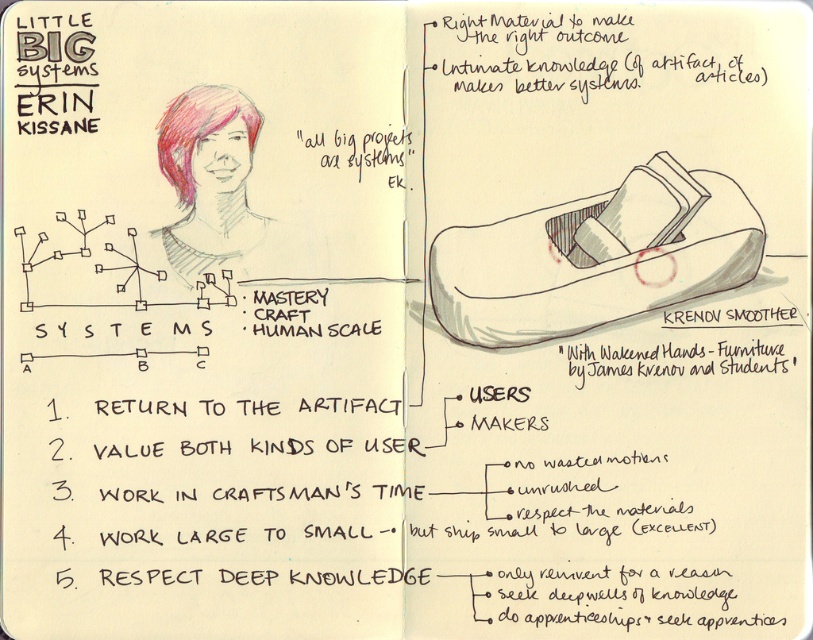
Can you confirm if matte gray wood shoe at upper right is shorter than matte black artifact at upper right?

Incorrect, matte gray wood shoe at upper right's height does not fall short of matte black artifact at upper right's.

The width and height of the screenshot is (813, 640). Identify the location of matte gray wood shoe at upper right. (594, 257).